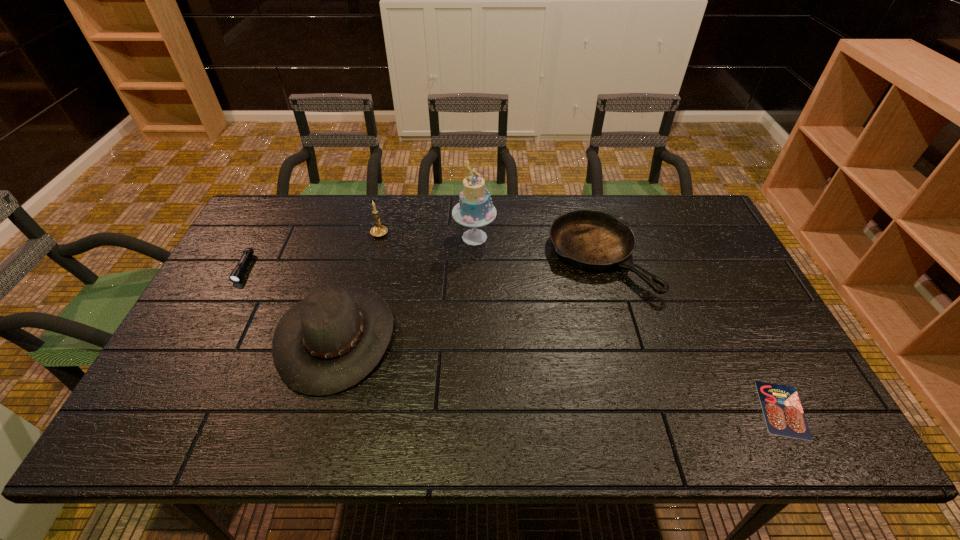
The image size is (960, 540). Find the location of `the fourth object from left to right`. the fourth object from left to right is located at coordinates (475, 209).

You are a GUI agent. You are given a task and a screenshot of the screen. Output one action in this format:
    pyautogui.click(x=<x>, y=<y>)
    Task: Click on the tallest object
    
    Given the screenshot: What is the action you would take?
    pyautogui.click(x=475, y=209)

Locate an element on the screen. candle holder is located at coordinates (379, 230).

Image resolution: width=960 pixels, height=540 pixels. I want to click on hat, so click(x=331, y=340).

Identify the location of the third shortest object. click(592, 240).

This screenshot has width=960, height=540. I want to click on the fifth object from left to right, so click(x=592, y=240).

Where is `the leftmost object`? the leftmost object is located at coordinates (237, 273).

Locate an element on the screen. This screenshot has height=540, width=960. flashlight is located at coordinates (237, 273).

Where is `salami`? The height and width of the screenshot is (540, 960). salami is located at coordinates (784, 416).

Image resolution: width=960 pixels, height=540 pixels. Find the location of `the rightmost object`. the rightmost object is located at coordinates (784, 416).